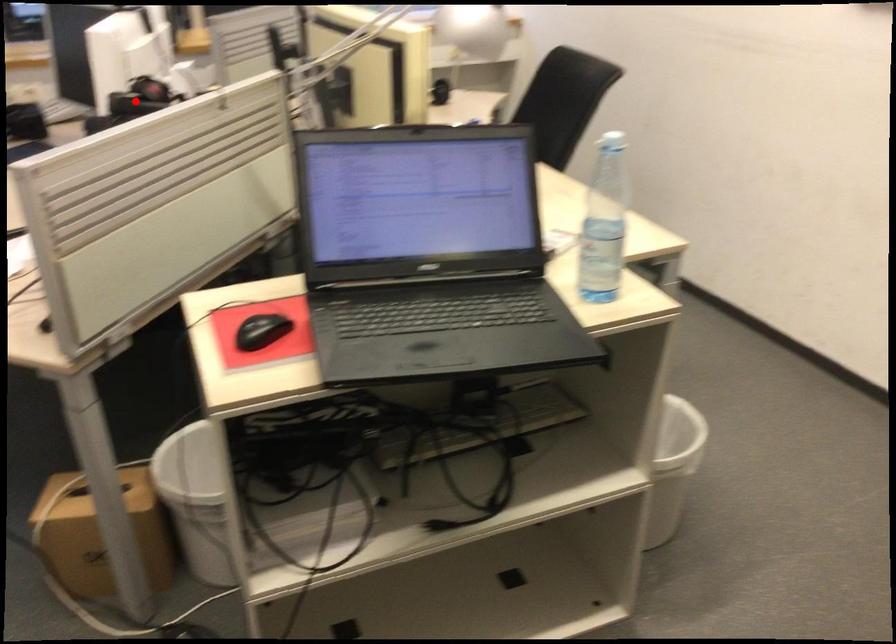
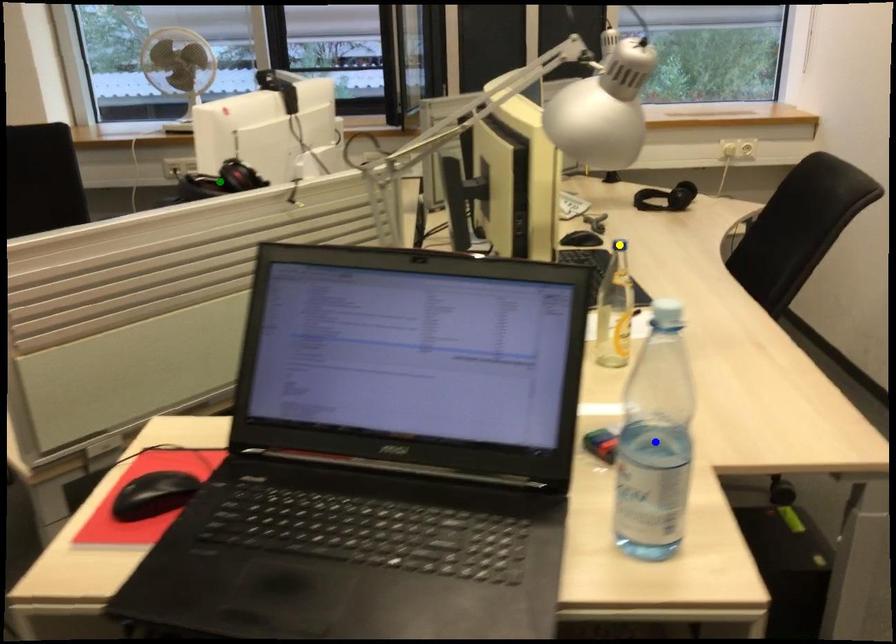
Question: I am providing you with two images of the same scene from different viewpoints. A red point is marked on the first image. You are given multiple points on the second image. Which mark in image 2 goes with the point in image 1?

Choices:
 (A) green point
 (B) blue point
 (C) yellow point

Answer: (A)